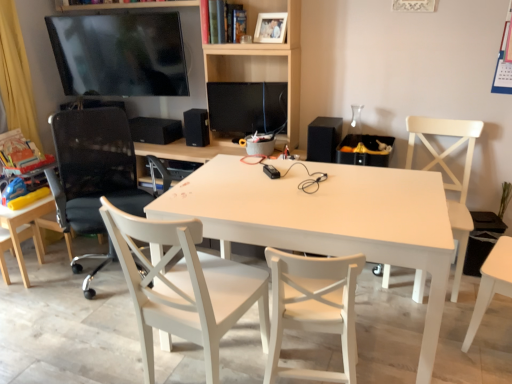
The width and height of the screenshot is (512, 384). I want to click on vacant region to the left of white wood chair at center, the 3th chair positioned from the right, so click(106, 350).